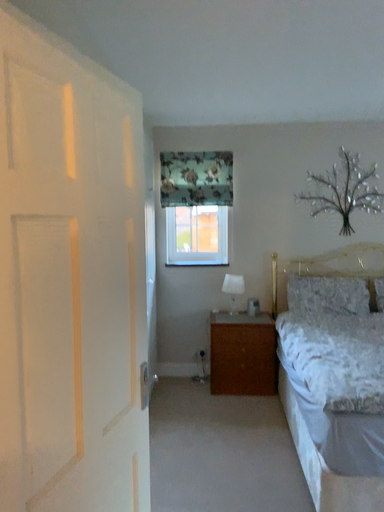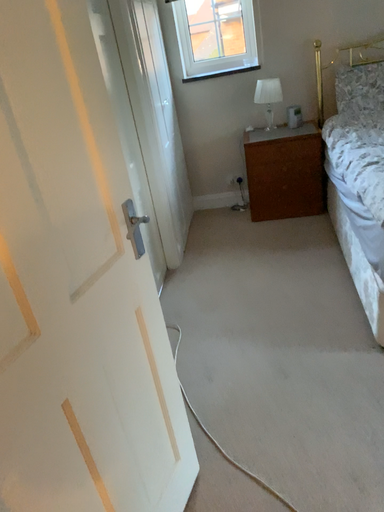
Question: How did the camera likely rotate when shooting the video?

Choices:
 (A) rotated upward
 (B) rotated downward

Answer: (B)